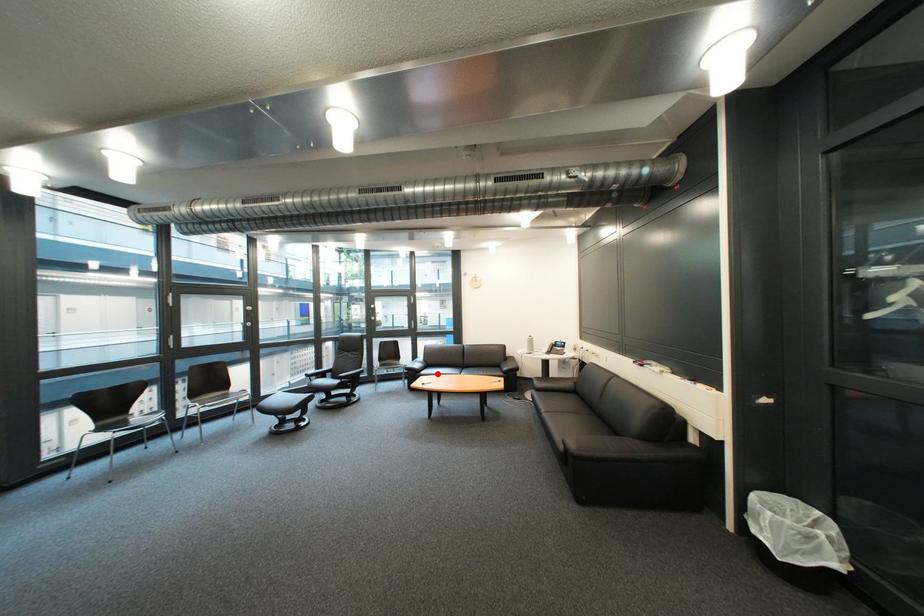
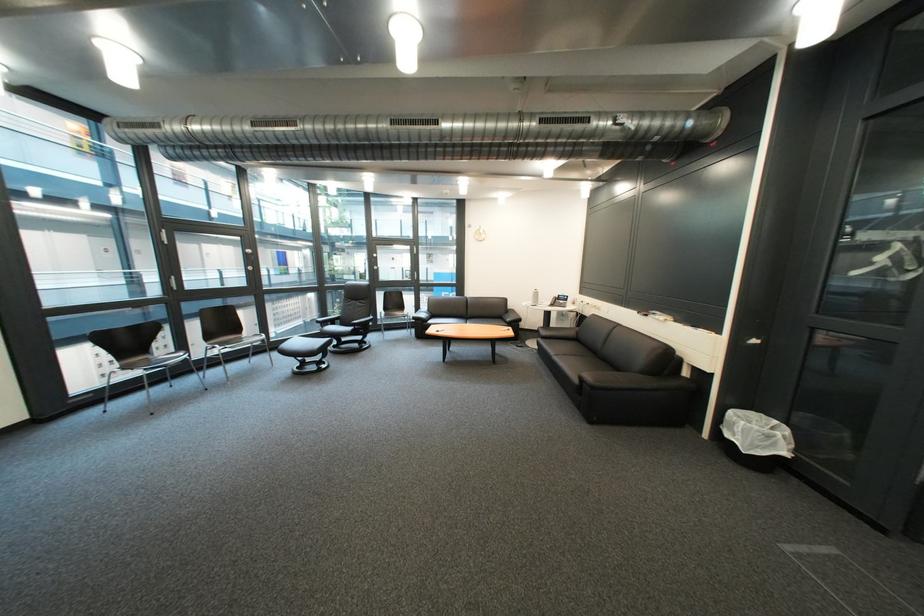
Find the pixel in the second image that matches the highlighted location in the first image.

(444, 323)